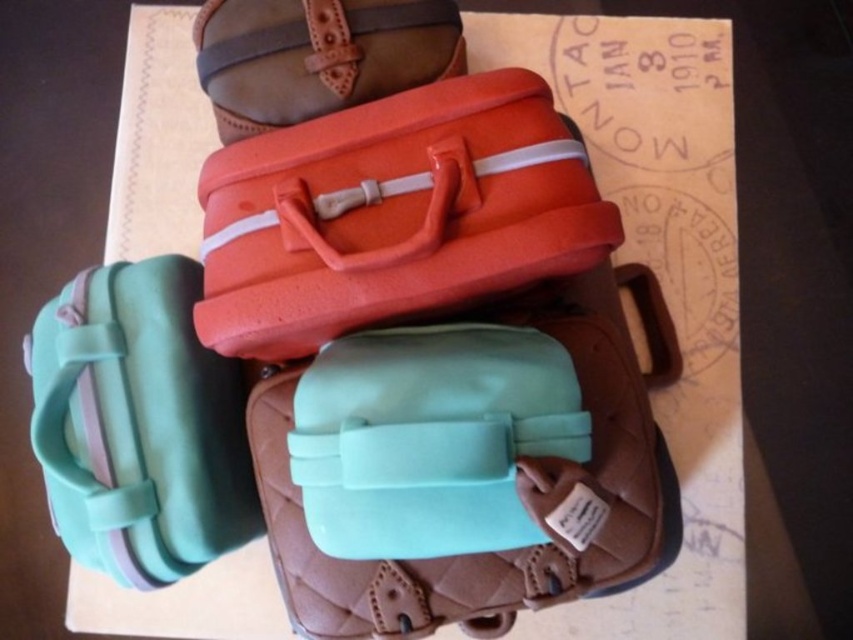
You are a delivery person who needs to place a new cake on the stack. The new cake must be placed on top of the orange matte suitcase at center. Where should you position it?

The orange matte suitcase at center is located at point (x=393, y=212), so you should place the new cake directly above this coordinate to ensure it is positioned correctly on top of the orange matte suitcase at center.

You are a bakery assistant who needs to place a new cake on the display. The new cake is taller than the mint green plastic suitcase at lower left. Can you place it on the shelf where the matte orange suitcase at upper center is located?

The mint green plastic suitcase at lower left is much taller than the matte orange suitcase at upper center. Since the new cake is taller than the mint green plastic suitcase at lower left, it would be too tall to fit on the shelf with the matte orange suitcase at upper center.